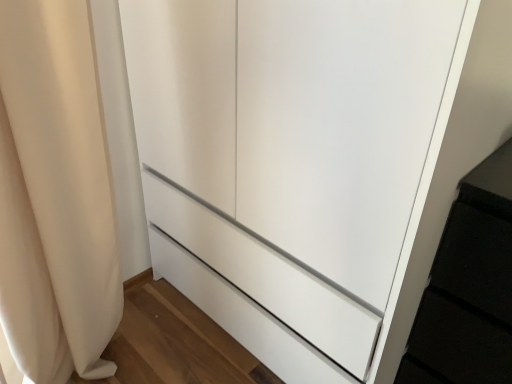
Question: Based on their sizes in the image, would you say beige fabric curtain at left is bigger or smaller than white glossy cupboard at center?

Choices:
 (A) big
 (B) small

Answer: (B)

Question: From a real-world perspective, is beige fabric curtain at left physically located above or below white glossy cupboard at center?

Choices:
 (A) below
 (B) above

Answer: (A)

Question: In terms of width, does beige fabric curtain at left look wider or thinner when compared to white glossy cupboard at center?

Choices:
 (A) thin
 (B) wide

Answer: (A)

Question: Considering the positions of white glossy cupboard at center and beige fabric curtain at left in the image, is white glossy cupboard at center taller or shorter than beige fabric curtain at left?

Choices:
 (A) tall
 (B) short

Answer: (A)

Question: In terms of size, does white glossy cupboard at center appear bigger or smaller than beige fabric curtain at left?

Choices:
 (A) small
 (B) big

Answer: (B)

Question: Considering the positions of point (369, 81) and point (16, 147), is point (369, 81) closer or farther from the camera than point (16, 147)?

Choices:
 (A) farther
 (B) closer

Answer: (B)

Question: From a real-world perspective, is white glossy cupboard at center physically located above or below beige fabric curtain at left?

Choices:
 (A) above
 (B) below

Answer: (A)